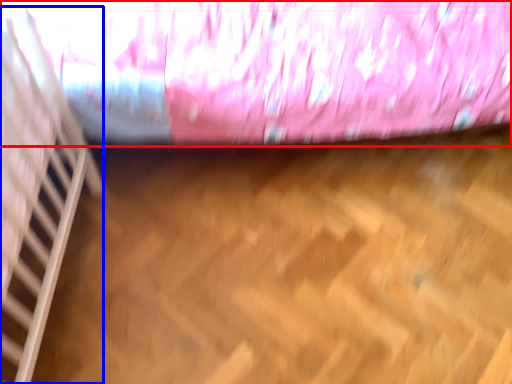
Question: Which point is closer to the camera, curtain (highlighted by a red box) or stairwell (highlighted by a blue box)?

Choices:
 (A) curtain
 (B) stairwell

Answer: (B)